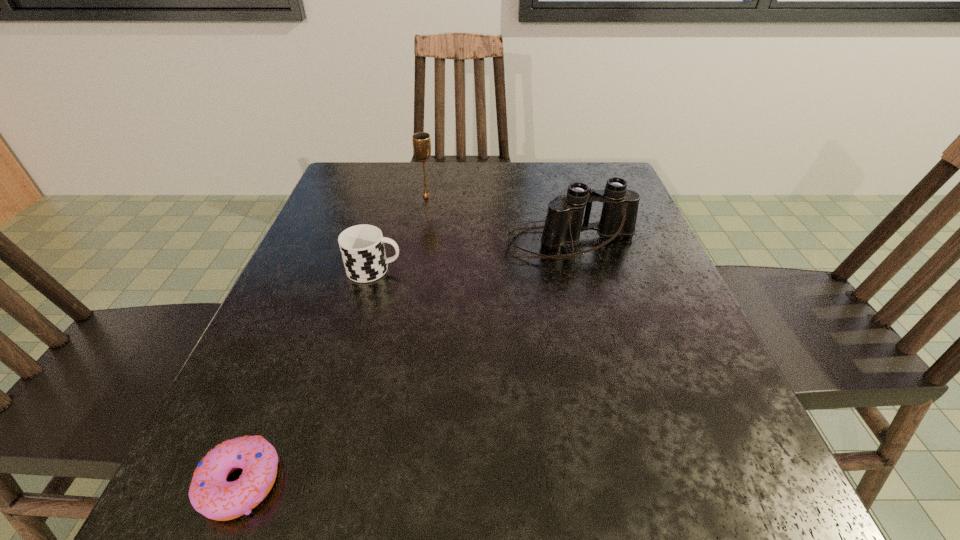
You are a GUI agent. You are given a task and a screenshot of the screen. Output one action in this format:
    pyautogui.click(x=<x>, y=<y>)
    Task: Click on the free point between the nearest object and the chalice
    The image size is (960, 540).
    Given the screenshot: What is the action you would take?
    pyautogui.click(x=333, y=339)

Find the location of `vacant space that is in between the rightmost object and the doughnut`. vacant space that is in between the rightmost object and the doughnut is located at coordinates (405, 363).

Find the location of `free space between the shortest object and the cup`. free space between the shortest object and the cup is located at coordinates (307, 376).

The height and width of the screenshot is (540, 960). I want to click on object that is the closest to the shortest object, so pos(362,248).

Identify the location of the second closest object to the third tallest object. (421, 141).